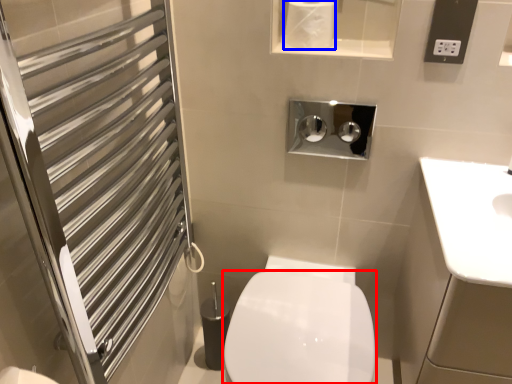
Question: Among these objects, which one is farthest to the camera, bidet (highlighted by a red box) or toilet paper (highlighted by a blue box)?

Choices:
 (A) bidet
 (B) toilet paper

Answer: (B)